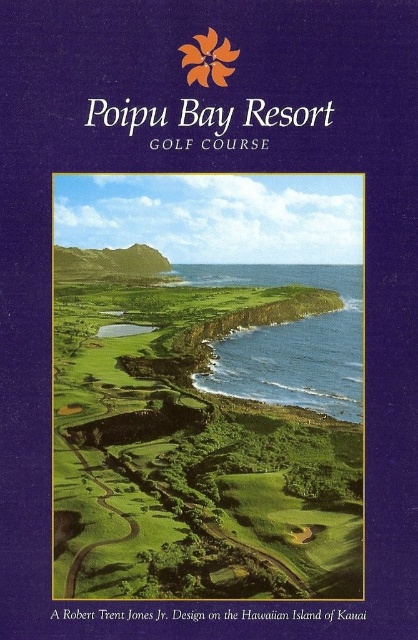
Between point (325, 579) and point (259, 385), which one is positioned in front?

Point (325, 579) is in front.

Identify the location of green grassy golf course at center. This screenshot has height=640, width=418. (193, 456).